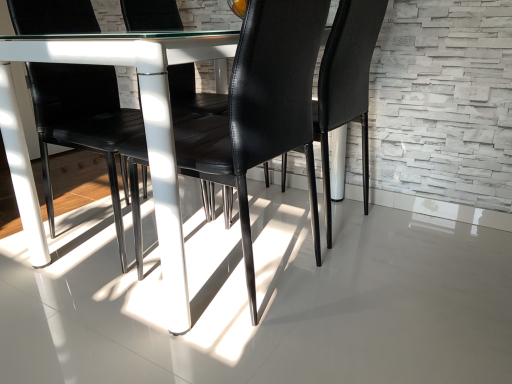
Question: Is white glossy concrete at center spatially inside black leather chair at center, marked as the first chair in a front-to-back arrangement, or outside of it?

Choices:
 (A) outside
 (B) inside

Answer: (A)

Question: In terms of height, does white glossy concrete at center look taller or shorter compared to black leather chair at center, arranged as the 2th chair when viewed from the back?

Choices:
 (A) short
 (B) tall

Answer: (A)

Question: Estimate the real-world distances between objects in this image. Which object is farther from the black leather chair at center, arranged as the 2th chair when viewed from the back?

Choices:
 (A) white glossy concrete at center
 (B) black leather chair at center, arranged as the first chair when viewed from the back

Answer: (B)

Question: Which object is the farthest from the black leather chair at center, arranged as the 2th chair when viewed from the back?

Choices:
 (A) black leather chair at center, arranged as the first chair when viewed from the back
 (B) white glossy concrete at center

Answer: (A)